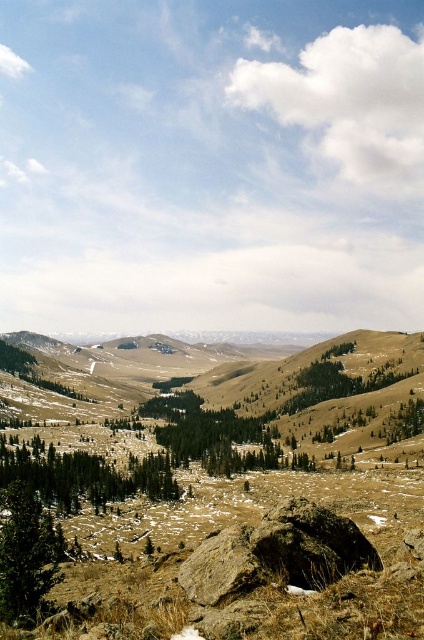
Question: Which object is closer to the camera taking this photo?

Choices:
 (A) green matte tree at lower left
 (B) brown rough rock at center

Answer: (B)

Question: Does brown rough rock at center have a larger size compared to green matte tree at center?

Choices:
 (A) no
 (B) yes

Answer: (A)

Question: Considering the relative positions of brown rough rock at center and green matte tree at lower left in the image provided, where is brown rough rock at center located with respect to green matte tree at lower left?

Choices:
 (A) below
 (B) above

Answer: (B)

Question: Which object is closer to the camera taking this photo?

Choices:
 (A) green matte tree at lower left
 (B) brown rough rock at center
 (C) green matte tree at center

Answer: (B)

Question: Among these points, which one is farthest from the camera?

Choices:
 (A) (60, 538)
 (B) (147, 490)

Answer: (B)

Question: In this image, where is brown rough rock at center located relative to green matte tree at center?

Choices:
 (A) above
 (B) below

Answer: (A)